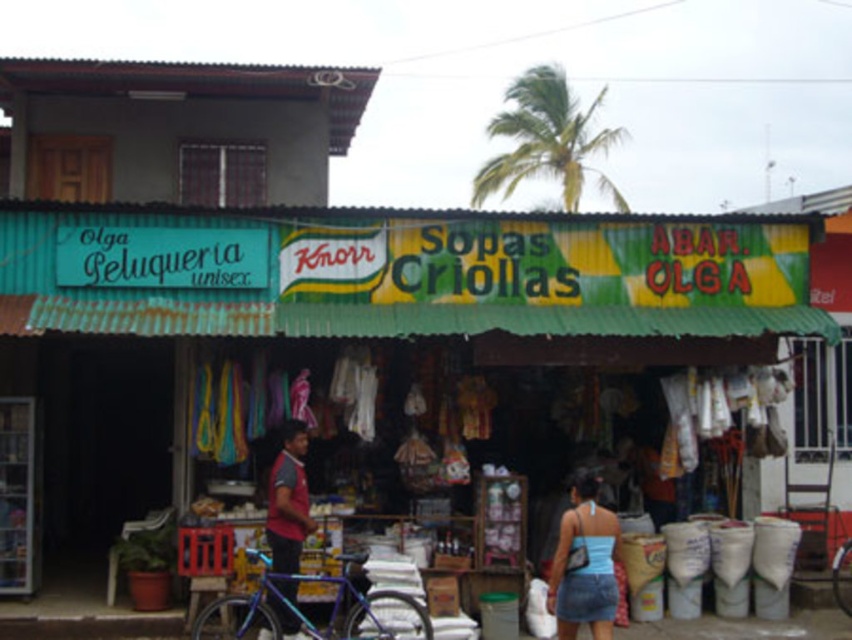
Does blue denim skirt at lower right have a smaller size compared to red fabric shirt at center?

Correct, blue denim skirt at lower right occupies less space than red fabric shirt at center.

Looking at this image, is blue denim skirt at lower right behind red fabric shirt at center?

No, it is in front of red fabric shirt at center.

This screenshot has width=852, height=640. Find the location of `blue denim skirt at lower right`. blue denim skirt at lower right is located at coordinates (584, 564).

Consider the image. Can you confirm if teal painted wood peluqueria sign at upper left is positioned above blue metallic bicycle at center?

Yes.

Based on the photo, how distant is teal painted wood peluqueria sign at upper left from blue metallic bicycle at center?

The distance of teal painted wood peluqueria sign at upper left from blue metallic bicycle at center is 8.67 meters.

This screenshot has width=852, height=640. Identify the location of teal painted wood peluqueria sign at upper left. (133, 288).

Can you confirm if shiny blue frame bicycle at center is shorter than blue denim skirt at lower right?

A: Correct, shiny blue frame bicycle at center is not as tall as blue denim skirt at lower right.

Is point (245, 602) in front of point (600, 518)?

No, (245, 602) is further to viewer.

Find the location of a particular element. shiny blue frame bicycle at center is located at coordinates (304, 614).